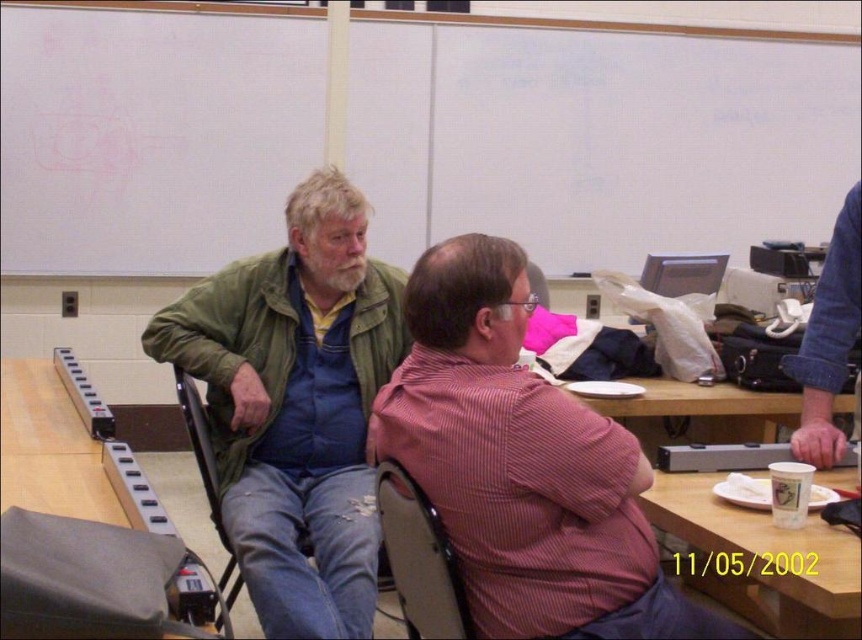
Based on the photo, is white matte board at upper center to the left of green fabric chair at left from the viewer's perspective?

Incorrect, white matte board at upper center is not on the left side of green fabric chair at left.

Does point (826, 129) come behind point (223, 589)?

Yes, point (826, 129) is behind point (223, 589).

You are a GUI agent. You are given a task and a screenshot of the screen. Output one action in this format:
    pyautogui.click(x=<x>, y=<y>)
    Task: Click on the white matte board at upper center
    The width and height of the screenshot is (862, 640).
    Given the screenshot: What is the action you would take?
    pyautogui.click(x=597, y=140)

From the picture: Between metallic gray chair at center and matte plastic chair at center, which one is positioned lower?

Positioned lower is metallic gray chair at center.

From the picture: Does metallic gray chair at center have a greater height compared to matte plastic chair at center?

Correct, metallic gray chair at center is much taller as matte plastic chair at center.

Image resolution: width=862 pixels, height=640 pixels. Describe the element at coordinates (419, 557) in the screenshot. I see `metallic gray chair at center` at that location.

At what (x,y) coordinates should I click in order to perform the action: click on metallic gray chair at center. Please return your answer as a coordinate pair (x, y). This screenshot has height=640, width=862. Looking at the image, I should click on (419, 557).

Who is more forward, (x=188, y=324) or (x=192, y=397)?

Point (x=188, y=324) is in front.

Which of these two, green matte jacket at center or green fabric chair at left, stands taller?

Standing taller between the two is green matte jacket at center.

Is point (251, 428) less distant than point (186, 417)?

That is False.

I want to click on green matte jacket at center, so click(x=297, y=406).